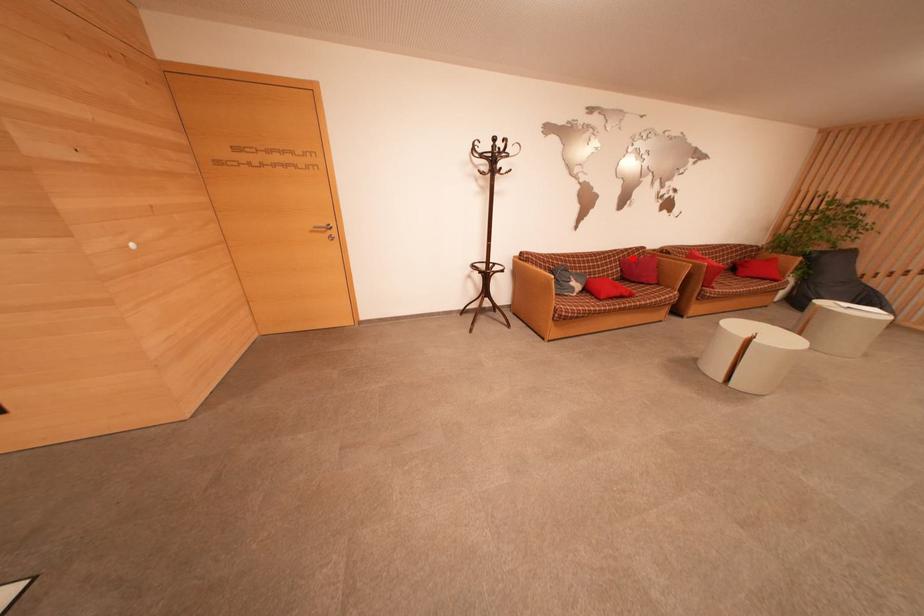
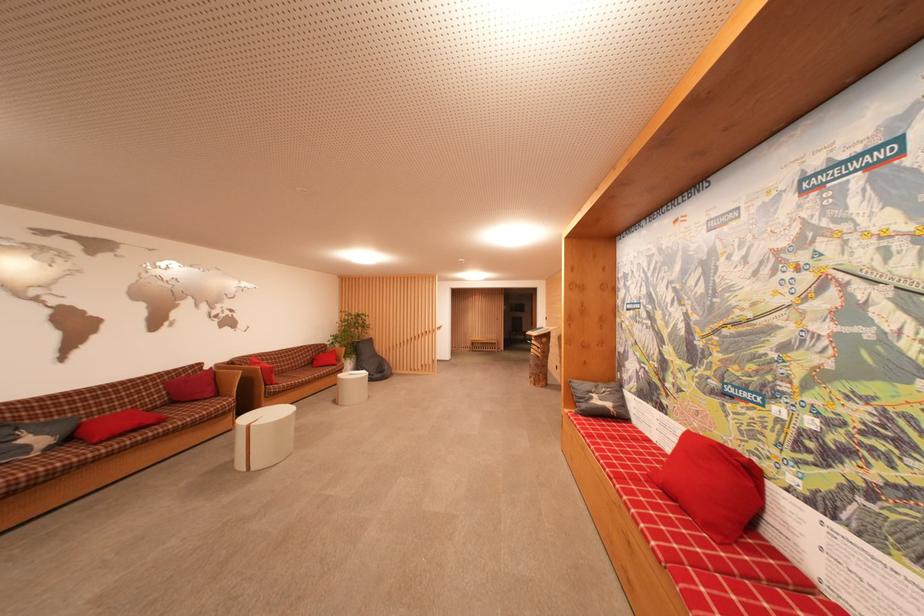
Locate, in the second image, the point that corresponds to the highlighted location in the first image.

(183, 378)